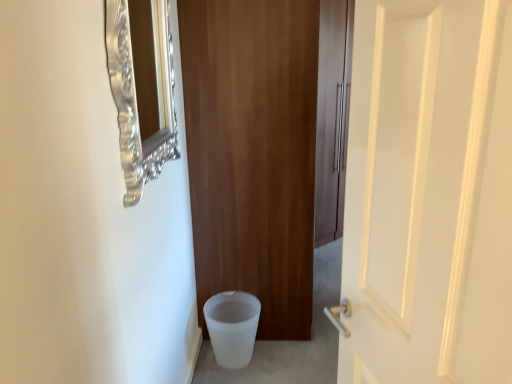
Question: Can you confirm if silver ornate mirror at upper left is shorter than white glossy door at right, the first door viewed from the front?

Choices:
 (A) yes
 (B) no

Answer: (A)

Question: Can you confirm if silver ornate mirror at upper left is smaller than white glossy door at right, the first door viewed from the front?

Choices:
 (A) no
 (B) yes

Answer: (B)

Question: Is silver ornate mirror at upper left aimed at white glossy door at right, the first door viewed from the front?

Choices:
 (A) yes
 (B) no

Answer: (B)

Question: Considering the relative positions of silver ornate mirror at upper left and white glossy door at right, the first door viewed from the front, in the image provided, is silver ornate mirror at upper left to the left of white glossy door at right, the first door viewed from the front, from the viewer's perspective?

Choices:
 (A) no
 (B) yes

Answer: (B)

Question: From the image's perspective, is silver ornate mirror at upper left below white glossy door at right, the first door viewed from the front?

Choices:
 (A) no
 (B) yes

Answer: (A)

Question: Is silver ornate mirror at upper left closer to camera compared to white glossy door at right, the first door viewed from the front?

Choices:
 (A) yes
 (B) no

Answer: (B)

Question: From a real-world perspective, is silver ornate mirror at upper left below wooden door at center, the 1th door viewed from the back?

Choices:
 (A) yes
 (B) no

Answer: (B)

Question: Is silver ornate mirror at upper left closer to the viewer compared to wooden door at center, the 2th door viewed from the front?

Choices:
 (A) no
 (B) yes

Answer: (B)

Question: Could you tell me if silver ornate mirror at upper left is facing wooden door at center, the 1th door viewed from the back?

Choices:
 (A) yes
 (B) no

Answer: (B)

Question: Is silver ornate mirror at upper left smaller than wooden door at center, the 2th door viewed from the front?

Choices:
 (A) no
 (B) yes

Answer: (B)

Question: Is silver ornate mirror at upper left in contact with wooden door at center, the 1th door viewed from the back?

Choices:
 (A) yes
 (B) no

Answer: (B)

Question: Can you confirm if silver ornate mirror at upper left is bigger than wooden door at center, the 1th door viewed from the back?

Choices:
 (A) no
 (B) yes

Answer: (A)

Question: Is white frosted potty at lower left taller than wooden door at center, the 2th door viewed from the front?

Choices:
 (A) yes
 (B) no

Answer: (B)